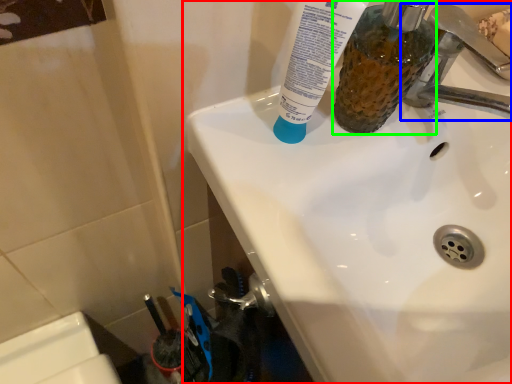
Question: Which is farther away from sink (highlighted by a red box)? tap (highlighted by a blue box) or mouthwash (highlighted by a green box)?

Choices:
 (A) tap
 (B) mouthwash

Answer: (A)